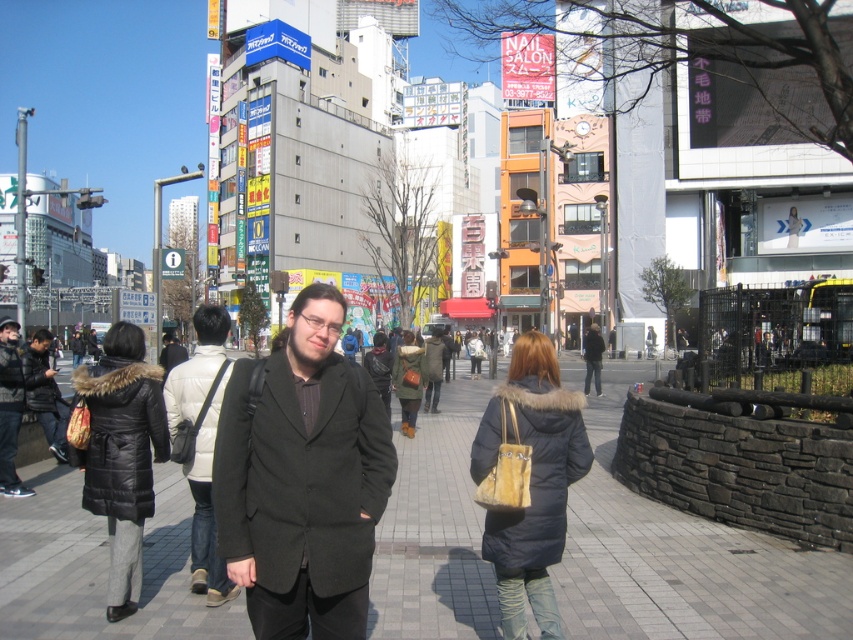
Between dark gray wool coat at center and black matte jacket at center, which one has less height?

Standing shorter between the two is dark gray wool coat at center.

Between dark gray wool coat at center and black matte jacket at center, which one is positioned higher?

dark gray wool coat at center

Between point (322, 588) and point (201, 420), which one is positioned in front?

Point (322, 588) is more forward.

Locate an element on the screen. This screenshot has height=640, width=853. dark gray wool coat at center is located at coordinates (302, 477).

Which of these two, brick pavement at center or black matte jacket at center, stands shorter?

With less height is brick pavement at center.

Is brick pavement at center below black matte jacket at center?

Correct, brick pavement at center is located below black matte jacket at center.

Between point (480, 572) and point (224, 349), which one is positioned behind?

The point (224, 349) is behind.

Find the location of a particular element. This screenshot has height=640, width=853. brick pavement at center is located at coordinates (682, 561).

Between brick pavement at center and dark gray wool coat at center, which one is positioned lower?

brick pavement at center is lower down.

Is brick pavement at center positioned at the back of dark gray wool coat at center?

Yes, brick pavement at center is behind dark gray wool coat at center.

Is point (664, 525) closer to camera compared to point (229, 432)?

No.

Where is `brick pavement at center`? The height and width of the screenshot is (640, 853). brick pavement at center is located at coordinates (682, 561).